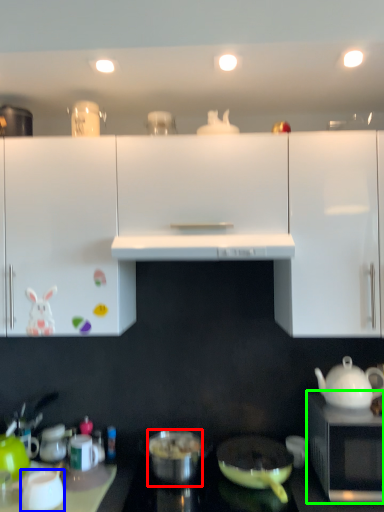
Question: Which object is positioned farthest from pot/pan (highlighted by a red box)? Select from coffee cup (highlighted by a blue box) and microwave oven (highlighted by a green box).

Choices:
 (A) coffee cup
 (B) microwave oven

Answer: (B)